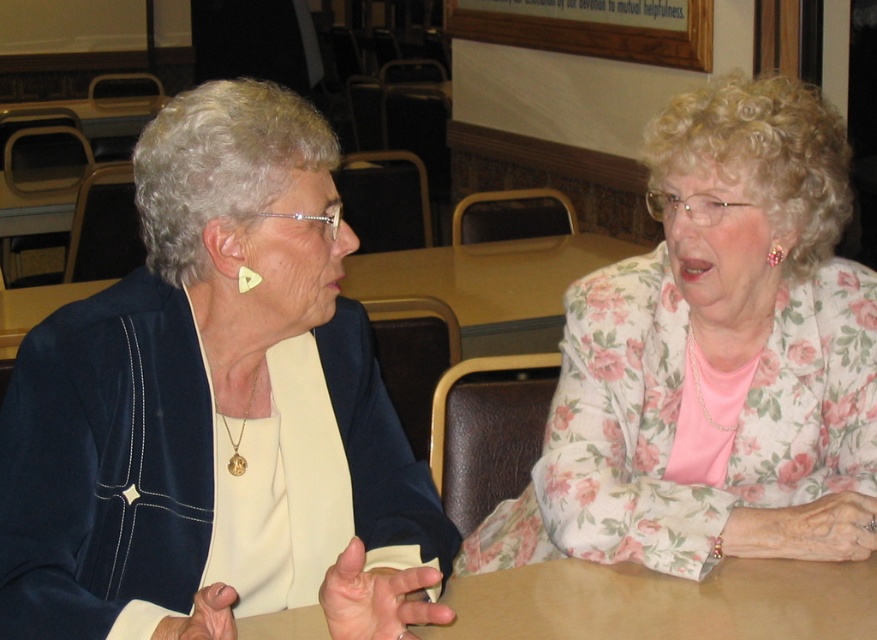
You are a photographer standing at the back of the room. You want to take a photo of the matte black jacket at left and the brown wooden table at center so that both are clearly visible in the frame. Given that your camera has a minimum focus distance of 12 inches, will you need to step back to ensure both objects are in focus?

The matte black jacket at left is 11.35 inches away from the brown wooden table at center. Since the camera requires a minimum focus distance of 12 inches, you will need to step back to ensure both objects are within the camera range.

From the picture: You are a photographer at the event and want to take a portrait of the two women. The matte black jacket at left and the brown wooden table at center are in the frame. Which object is positioned higher in the image?

The matte black jacket at left is above the brown wooden table at center, so it is positioned higher in the image.